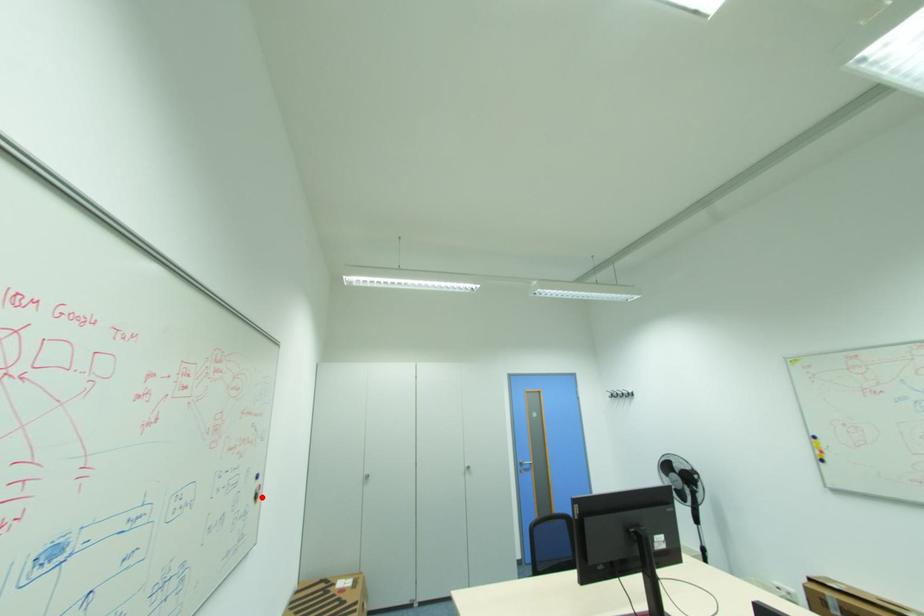
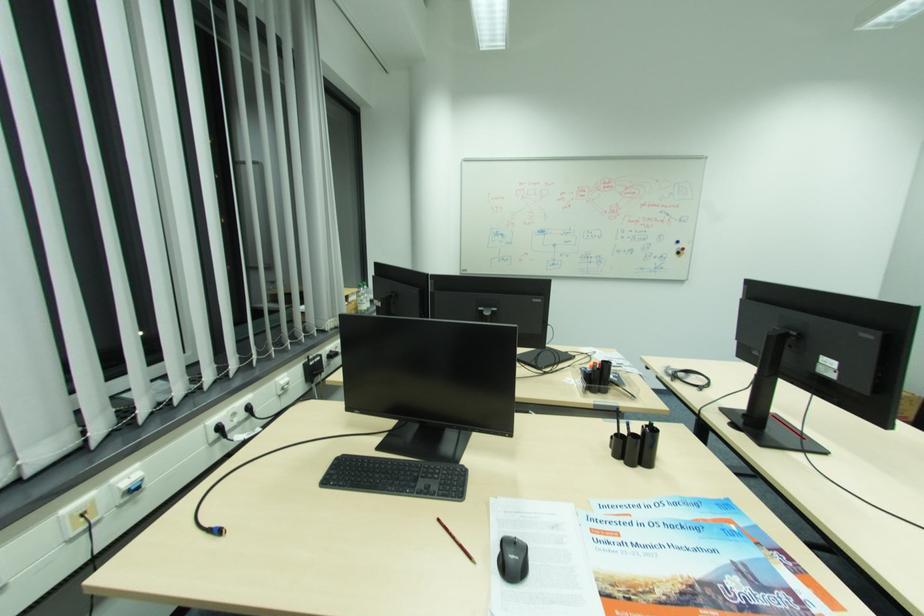
Locate, in the second image, the point that corresponds to the highlighted location in the first image.

(684, 253)